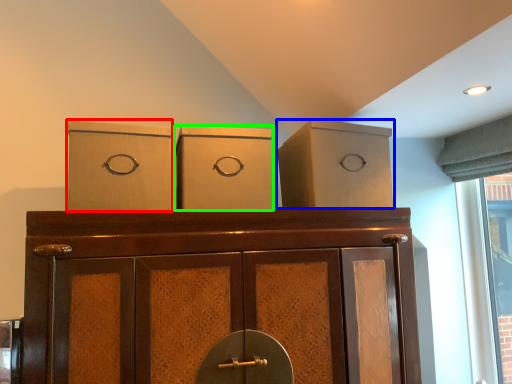
Question: Estimate the real-world distances between objects in this image. Which object is farther from cardboard box (highlighted by a red box), cabinetry (highlighted by a blue box) or cardboard box (highlighted by a green box)?

Choices:
 (A) cabinetry
 (B) cardboard box

Answer: (A)